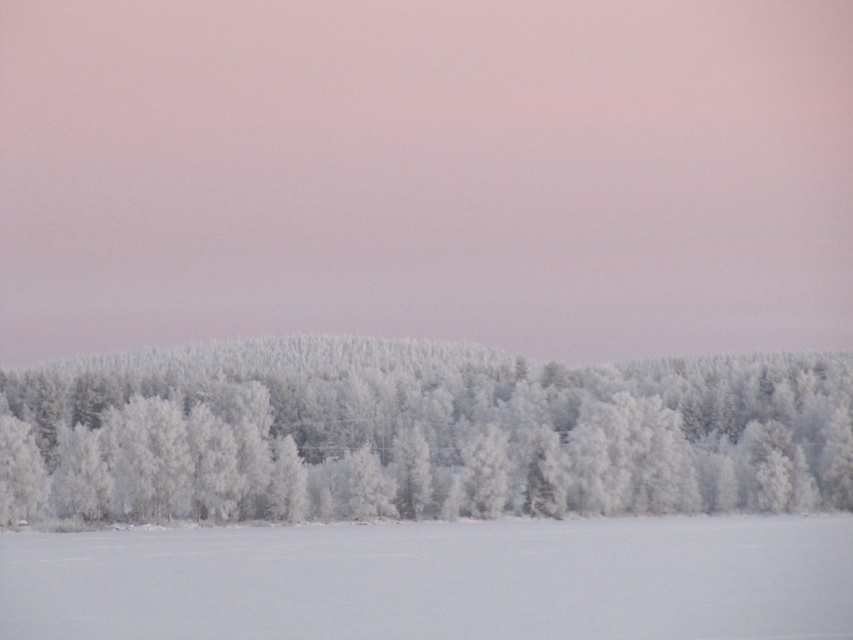
Is frosted white trees at center above white frosty snow at lower center?

Correct, frosted white trees at center is located above white frosty snow at lower center.

Can you confirm if frosted white trees at center is positioned to the left of white frosty snow at lower center?

Correct, you'll find frosted white trees at center to the left of white frosty snow at lower center.

What do you see at coordinates (416, 435) in the screenshot?
I see `frosted white trees at center` at bounding box center [416, 435].

This screenshot has width=853, height=640. I want to click on frosted white trees at center, so click(416, 435).